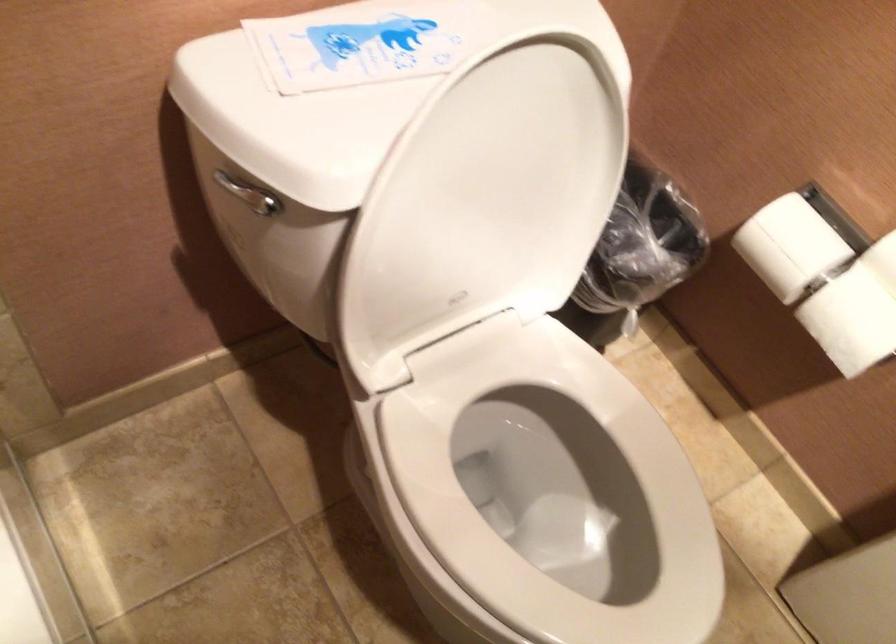
You are a GUI agent. You are given a task and a screenshot of the screen. Output one action in this format:
    pyautogui.click(x=<x>, y=<y>)
    Task: Click on the toilet flush handle
    The width and height of the screenshot is (896, 644).
    Given the screenshot: What is the action you would take?
    click(248, 194)